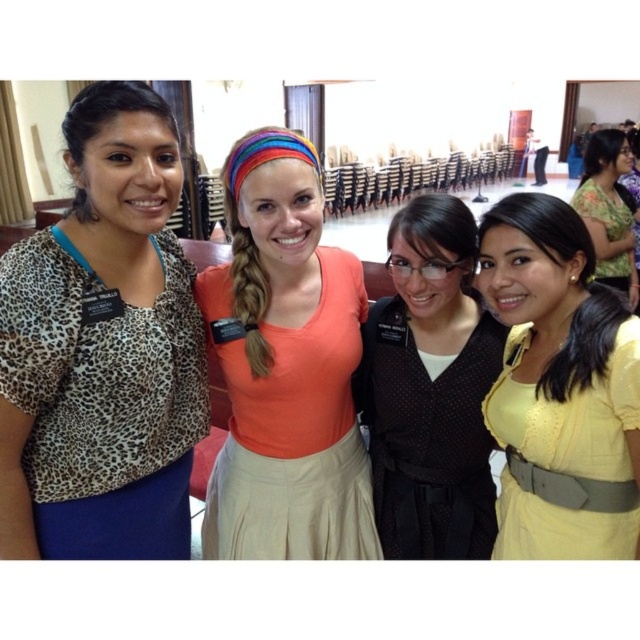
Is orange matte shirt at center thinner than matte black vest at center?

Incorrect, orange matte shirt at center's width is not less than matte black vest at center's.

Between orange matte shirt at center and matte black vest at center, which one appears on the right side from the viewer's perspective?

matte black vest at center is more to the right.

Between point (300, 532) and point (426, 291), which one is positioned behind?

Point (300, 532)

The image size is (640, 640). I want to click on orange matte shirt at center, so click(285, 368).

Can you confirm if yellow matte dress at center is positioned to the left of matte black vest at center?

In fact, yellow matte dress at center is to the right of matte black vest at center.

Is yellow matte dress at center positioned at the back of matte black vest at center?

No, it is in front of matte black vest at center.

Is point (538, 211) farther from viewer compared to point (454, 428)?

No, (538, 211) is in front of (454, 428).

Where is `yellow matte dress at center`? Image resolution: width=640 pixels, height=640 pixels. yellow matte dress at center is located at coordinates (557, 380).

Between yellow matte dress at center and floral fabric dress at upper right, which one is positioned higher?

floral fabric dress at upper right

Is yellow matte dress at center taller than floral fabric dress at upper right?

No.

Is point (579, 472) positioned behind point (614, 129)?

That is False.

I want to click on yellow matte dress at center, so click(557, 380).